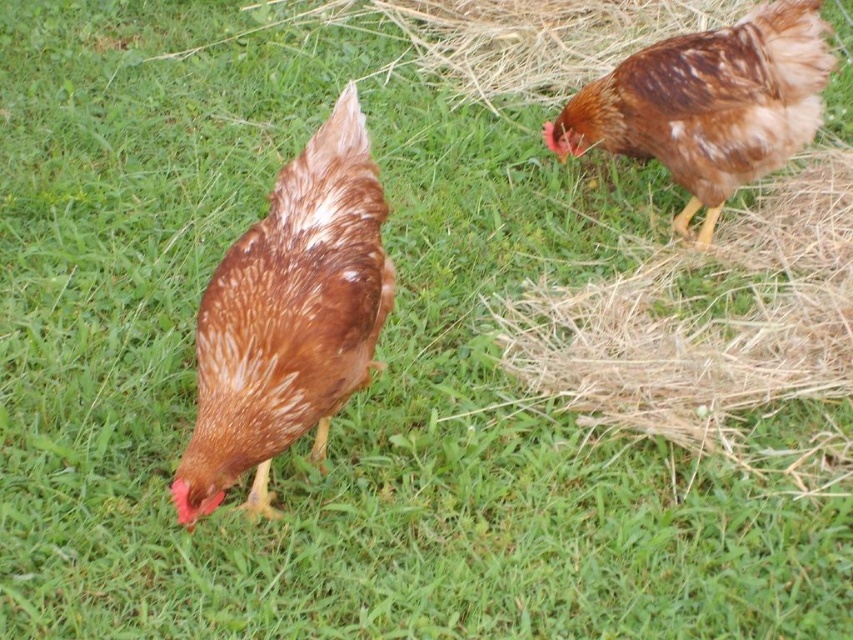
You are standing in a farmyard and see two chickens foraging. The first chicken is the one with reddish brown feathers speckled with white, actively pecking at the ground. The second chicken is darker and more upright. There is a point at coordinates point (572, 292) that is 3.26 meters away from you. If you want to throw a handful of feed to reach both chickens, will the point be far enough for the feed to land where both can reach it?

The point at (572, 292) is 3.26 meters away from the viewer. Since both chickens are within the foraging area in the foreground and background, the feed thrown to that point may reach both chickens if their foraging range extends to that location. However, the exact reach depends on how far each chicken is from the point, which isn,t specified.

You are standing in the middle of the grassy area where the two chickens are foraging. You notice a specific point marked at coordinates (288, 317). Which object from the scene does this point correspond to?

The point at coordinates (288, 317) corresponds to the brown speckled feather at center.